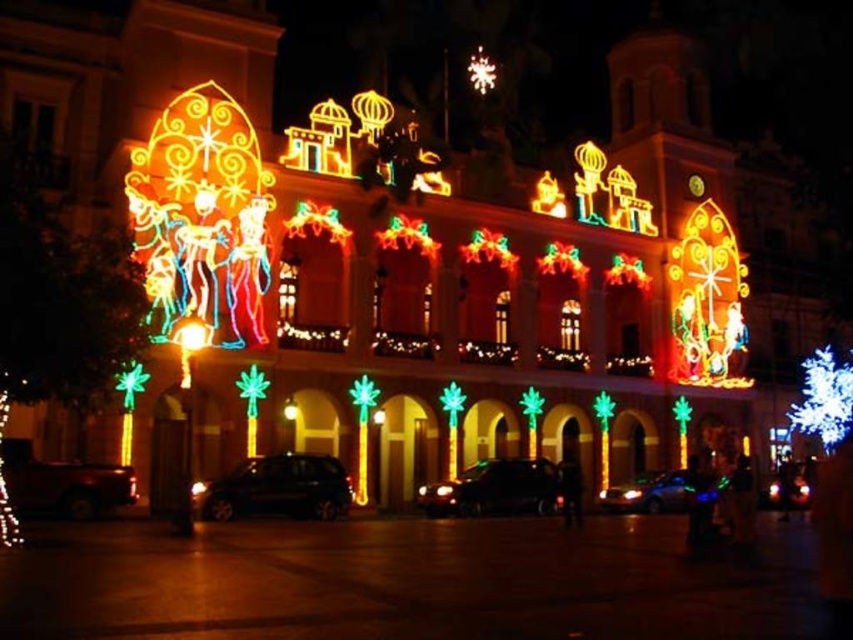
You are attending a Christmas event and notice two cars parked at the center of the scene. Which car has a larger width between the shiny black car at center and the shiny blue car at center?

The shiny black car at center has a larger width than the shiny blue car at center according to the description.

You are a photographer planning to take a picture of the festive building. You notice two cars in the foreground. The metallic silver car at lower left and the shiny blue car at center. Which car is positioned higher up relative to the building?

The metallic silver car at lower left is located above the shiny blue car at center, meaning it is positioned higher up relative to the building.